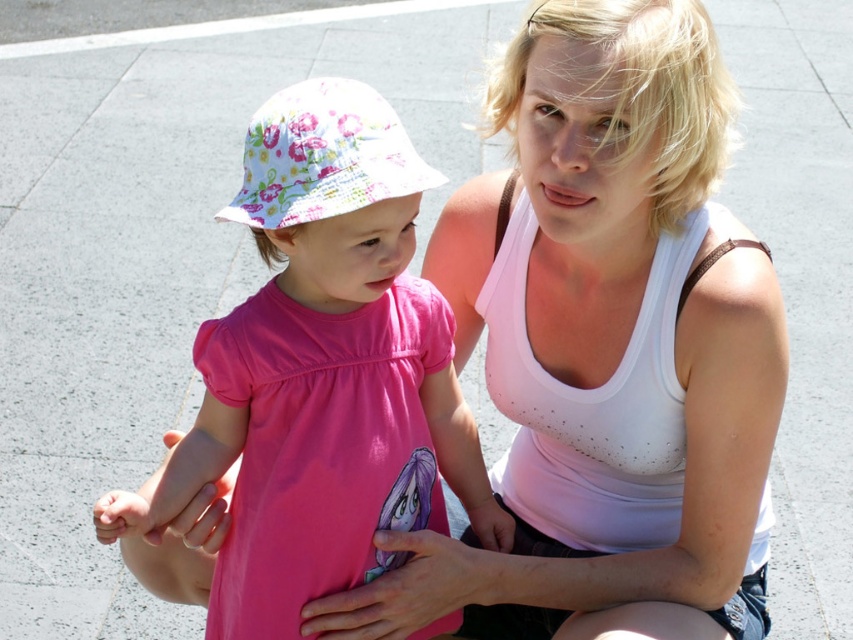
You are a photographer trying to capture a photo of both the pink fabric dress at center and the pink matte dress at center. Which dress should you focus on first if you want to start with the one closer to the left side of the frame?

The pink fabric dress at center is positioned on the left side of the pink matte dress at center, so you should focus on the pink fabric dress at center first.

You are a photographer setting up a shoot. You have two outfits to choose from for the main subject. The outfits are the pink matte dress at center and the white matte tank top at center. Which outfit takes up less horizontal space when worn?

The pink matte dress at center has a lesser width compared to the white matte tank top at center, so the pink matte dress at center takes up less horizontal space when worn.